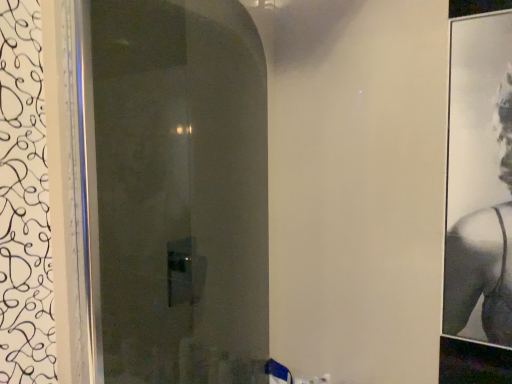
This screenshot has width=512, height=384. Find the location of `transparent glass door at left`. transparent glass door at left is located at coordinates (181, 191).

Describe the element at coordinates (181, 191) in the screenshot. I see `transparent glass door at left` at that location.

Image resolution: width=512 pixels, height=384 pixels. Find the location of `transparent glass door at left`. transparent glass door at left is located at coordinates (181, 191).